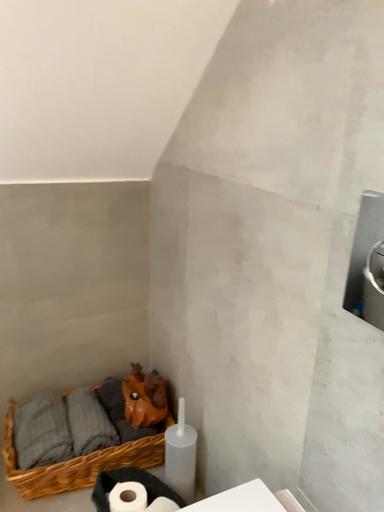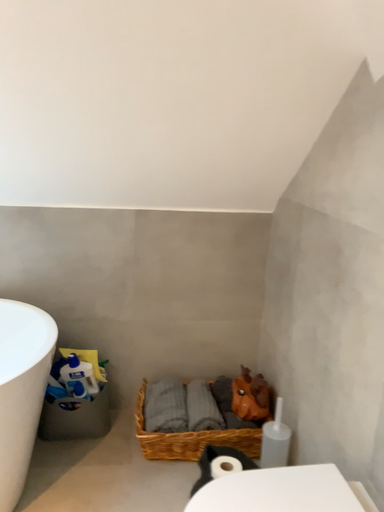
Question: How did the camera likely rotate when shooting the video?

Choices:
 (A) rotated right
 (B) rotated left

Answer: (B)